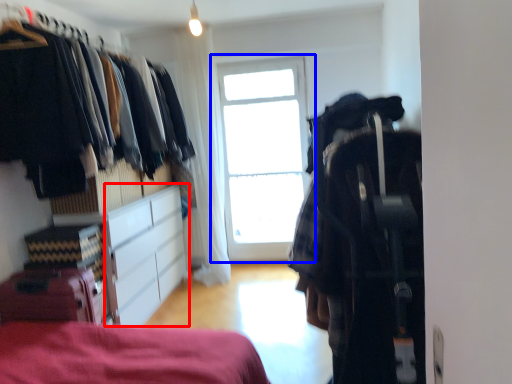
Question: Which object is further to the camera taking this photo, cabinetry (highlighted by a red box) or window (highlighted by a blue box)?

Choices:
 (A) cabinetry
 (B) window

Answer: (B)